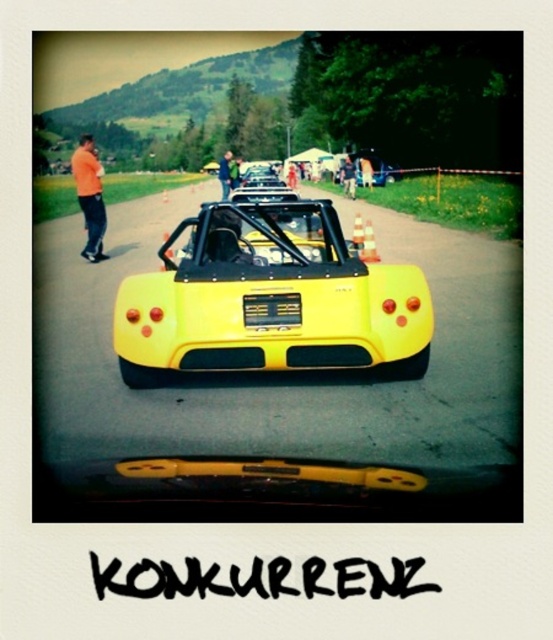
Consider the image. Can you confirm if yellow matte license plate at center is taller than denim pants at center?

No, yellow matte license plate at center is not taller than denim pants at center.

Which is behind, point (247, 308) or point (349, 173)?

Point (349, 173)

At what (x,y) coordinates should I click in order to perform the action: click on yellow matte license plate at center. Please return your answer as a coordinate pair (x, y). This screenshot has width=553, height=640. Looking at the image, I should click on (272, 308).

Between orange cotton shirt at left and yellow matte car at center, which one is positioned higher?

orange cotton shirt at left

Can you confirm if orange cotton shirt at left is positioned below yellow matte car at center?

No, orange cotton shirt at left is not below yellow matte car at center.

Does point (81, 211) come in front of point (267, 170)?

Yes, it is in front of point (267, 170).

This screenshot has width=553, height=640. Identify the location of orange cotton shirt at left. (90, 196).

Can you confirm if yellow matte sports car at center is thinner than blue denim jeans at center?

Indeed, yellow matte sports car at center has a lesser width compared to blue denim jeans at center.

The width and height of the screenshot is (553, 640). Identify the location of yellow matte sports car at center. (269, 292).